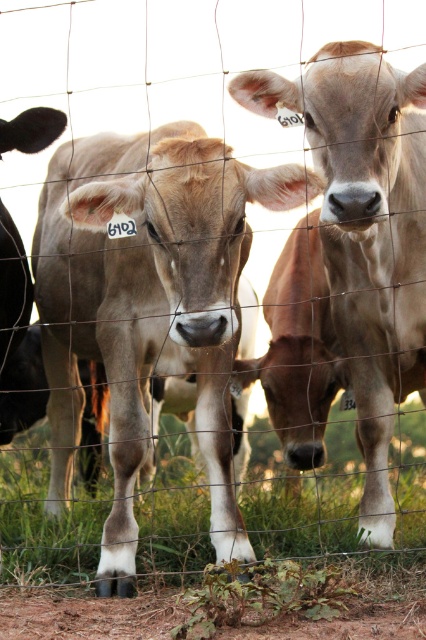
You are a farmer checking the pasture. You see the smooth tan bull at center and the green grass at lower center. How far apart are these two from each other?

The distance between the smooth tan bull at center and the green grass at lower center is 90.13 centimeters.

You are a farmer checking the herd. You see a point marked at coordinates (365, 232). What animal is located at that point?

The point at (365, 232) marks the location of the smooth tan bull at center.

You are a photographer trying to capture a clear shot of the smooth tan bull at center and the green grass at lower center. Which object will appear larger in your photo?

The smooth tan bull at center will appear larger in the photo because it is closer to the viewer than the green grass at lower center.